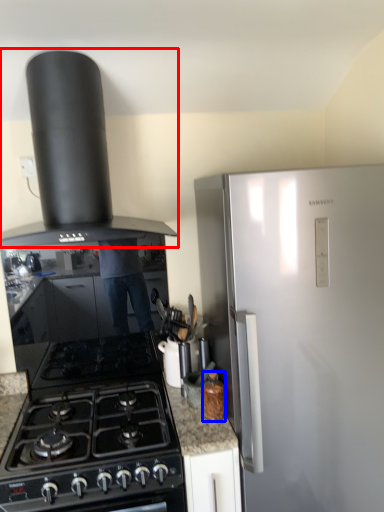
Question: Among these objects, which one is farthest to the camera, kitchen appliance (highlighted by a red box) or kitchen appliance (highlighted by a blue box)?

Choices:
 (A) kitchen appliance
 (B) kitchen appliance

Answer: (B)